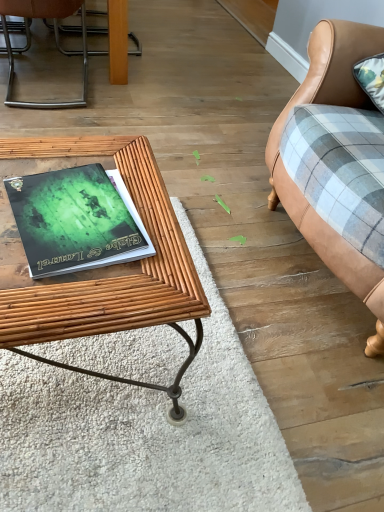
Question: From a real-world perspective, does leather couch at right stand above green matte book at center?

Choices:
 (A) yes
 (B) no

Answer: (A)

Question: Can you see leather couch at right touching green matte book at center?

Choices:
 (A) yes
 (B) no

Answer: (B)

Question: Does leather couch at right appear on the right side of green matte book at center?

Choices:
 (A) yes
 (B) no

Answer: (A)

Question: Would you say leather couch at right contains green matte book at center?

Choices:
 (A) yes
 (B) no

Answer: (B)

Question: Considering the relative positions of leather couch at right and green matte book at center in the image provided, is leather couch at right to the left of green matte book at center from the viewer's perspective?

Choices:
 (A) no
 (B) yes

Answer: (A)

Question: From the image's perspective, would you say leather couch at right is positioned over green matte book at center?

Choices:
 (A) yes
 (B) no

Answer: (A)

Question: Considering the relative positions of bambooobject at left and leather couch at right in the image provided, is bambooobject at left to the right of leather couch at right from the viewer's perspective?

Choices:
 (A) no
 (B) yes

Answer: (A)

Question: Considering the relative sizes of bambooobject at left and leather couch at right in the image provided, is bambooobject at left taller than leather couch at right?

Choices:
 (A) no
 (B) yes

Answer: (A)

Question: Considering the relative sizes of bambooobject at left and leather couch at right in the image provided, is bambooobject at left wider than leather couch at right?

Choices:
 (A) no
 (B) yes

Answer: (A)

Question: Is bambooobject at left next to leather couch at right and touching it?

Choices:
 (A) yes
 (B) no

Answer: (B)

Question: Can you confirm if bambooobject at left is bigger than leather couch at right?

Choices:
 (A) no
 (B) yes

Answer: (A)

Question: From the image's perspective, does bambooobject at left appear higher than leather couch at right?

Choices:
 (A) no
 (B) yes

Answer: (A)

Question: Is bambooobject at left in front of green matte book at center?

Choices:
 (A) yes
 (B) no

Answer: (A)